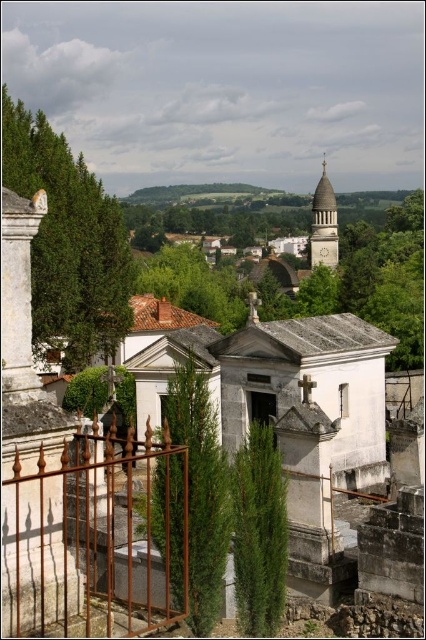
Which is more to the left, green textured stone wall at left or green textured stone at center?

green textured stone wall at left is more to the left.

Who is more distant from viewer, (x=46, y=291) or (x=173, y=564)?

The point (x=46, y=291) is behind.

Image resolution: width=426 pixels, height=640 pixels. I want to click on green textured stone wall at left, so click(69, 237).

Which of these two, green textured stone at center or green leafy tree at center, stands shorter?

With less height is green textured stone at center.

This screenshot has width=426, height=640. Describe the element at coordinates (201, 492) in the screenshot. I see `green textured stone at center` at that location.

The height and width of the screenshot is (640, 426). What are the coordinates of `green textured stone at center` in the screenshot? It's located at (201, 492).

Is point (244, 580) closer to viewer compared to point (141, 273)?

Yes, it is.

Which is more to the left, green coniferous tree at center or green leafy tree at center?

Positioned to the left is green leafy tree at center.

What do you see at coordinates (259, 532) in the screenshot?
I see `green coniferous tree at center` at bounding box center [259, 532].

Where is `green coniferous tree at center`? The image size is (426, 640). green coniferous tree at center is located at coordinates (259, 532).